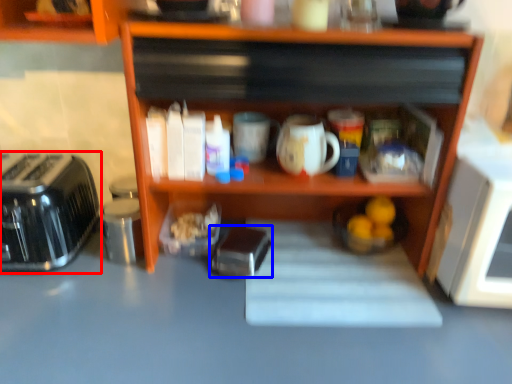
Question: Among these objects, which one is farthest to the camera, toaster (highlighted by a red box) or appliance (highlighted by a blue box)?

Choices:
 (A) toaster
 (B) appliance

Answer: (B)